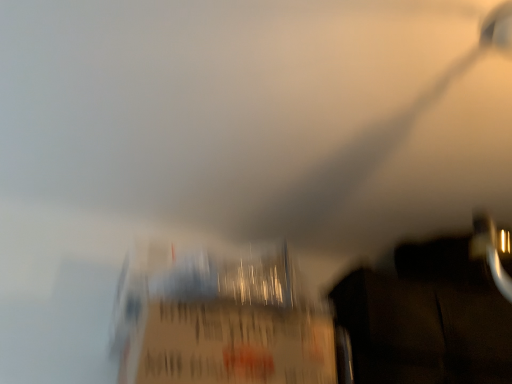
Question: Should I look upward or downward to see dark matte wood drawer at lower right?

Choices:
 (A) down
 (B) up

Answer: (A)

Question: Would you say matte cardboard box at center is outside dark matte wood drawer at lower right?

Choices:
 (A) no
 (B) yes

Answer: (B)

Question: From a real-world perspective, is matte cardboard box at center below dark matte wood drawer at lower right?

Choices:
 (A) no
 (B) yes

Answer: (B)

Question: Is dark matte wood drawer at lower right at the back of matte cardboard box at center?

Choices:
 (A) no
 (B) yes

Answer: (A)

Question: Considering the relative positions of matte cardboard box at center and dark matte wood drawer at lower right in the image provided, is matte cardboard box at center to the right of dark matte wood drawer at lower right from the viewer's perspective?

Choices:
 (A) yes
 (B) no

Answer: (B)

Question: Is matte cardboard box at center in front of dark matte wood drawer at lower right?

Choices:
 (A) no
 (B) yes

Answer: (B)

Question: Considering the relative sizes of matte cardboard box at center and dark matte wood drawer at lower right in the image provided, is matte cardboard box at center shorter than dark matte wood drawer at lower right?

Choices:
 (A) yes
 (B) no

Answer: (A)

Question: From a real-world perspective, is dark matte wood drawer at lower right positioned over matte cardboard box at center based on gravity?

Choices:
 (A) no
 (B) yes

Answer: (B)

Question: Considering the relative sizes of dark matte wood drawer at lower right and matte cardboard box at center in the image provided, is dark matte wood drawer at lower right taller than matte cardboard box at center?

Choices:
 (A) no
 (B) yes

Answer: (B)

Question: From a real-world perspective, is dark matte wood drawer at lower right beneath matte cardboard box at center?

Choices:
 (A) yes
 (B) no

Answer: (B)

Question: Is dark matte wood drawer at lower right closer to the viewer compared to matte cardboard box at center?

Choices:
 (A) no
 (B) yes

Answer: (A)

Question: Could you tell me if dark matte wood drawer at lower right is turned towards matte cardboard box at center?

Choices:
 (A) yes
 (B) no

Answer: (B)

Question: Can we say dark matte wood drawer at lower right lies outside matte cardboard box at center?

Choices:
 (A) no
 (B) yes

Answer: (B)

Question: Looking at their shapes, would you say dark matte wood drawer at lower right is wider or thinner than matte cardboard box at center?

Choices:
 (A) wide
 (B) thin

Answer: (A)